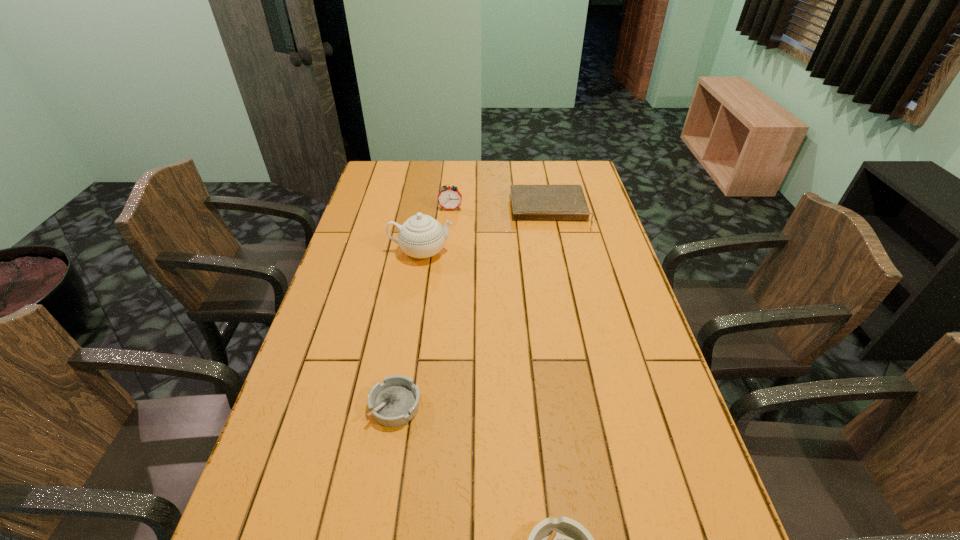
At what (x,y) coordinates should I click in order to perform the action: click on object situated at the left edge. Please return your answer as a coordinate pair (x, y). The width and height of the screenshot is (960, 540). Looking at the image, I should click on [x=421, y=236].

You are a GUI agent. You are given a task and a screenshot of the screen. Output one action in this format:
    pyautogui.click(x=<x>, y=<y>)
    Task: Click on the object present at the right edge
    The image size is (960, 540).
    Given the screenshot: What is the action you would take?
    pyautogui.click(x=529, y=202)

Find the location of a particular element. The image size is (960, 540). vacant area at the far edge of the desktop is located at coordinates (461, 161).

The height and width of the screenshot is (540, 960). I want to click on vacant region at the left edge, so click(338, 321).

Locate an element on the screen. The width and height of the screenshot is (960, 540). vacant space at the right edge of the desktop is located at coordinates click(x=623, y=293).

Where is `blank space at the far left corner of the desktop`? This screenshot has height=540, width=960. blank space at the far left corner of the desktop is located at coordinates (387, 184).

The image size is (960, 540). I want to click on vacant space at the far right corner, so click(x=572, y=180).

Find the location of a particular element. This screenshot has width=960, height=540. blank region between the paperback book and the left ashtray is located at coordinates (472, 308).

You are a GUI agent. You are given a task and a screenshot of the screen. Output one action in this format:
    pyautogui.click(x=<x>, y=<y>)
    Task: Click on the vacant space that's between the third nearest object and the second nearest object
    
    Given the screenshot: What is the action you would take?
    pyautogui.click(x=408, y=328)

At what (x,y) coordinates should I click in order to perform the action: click on free spot between the tallest object and the paperback book. Please return your answer as a coordinate pair (x, y). This screenshot has height=540, width=960. Looking at the image, I should click on click(x=486, y=232).